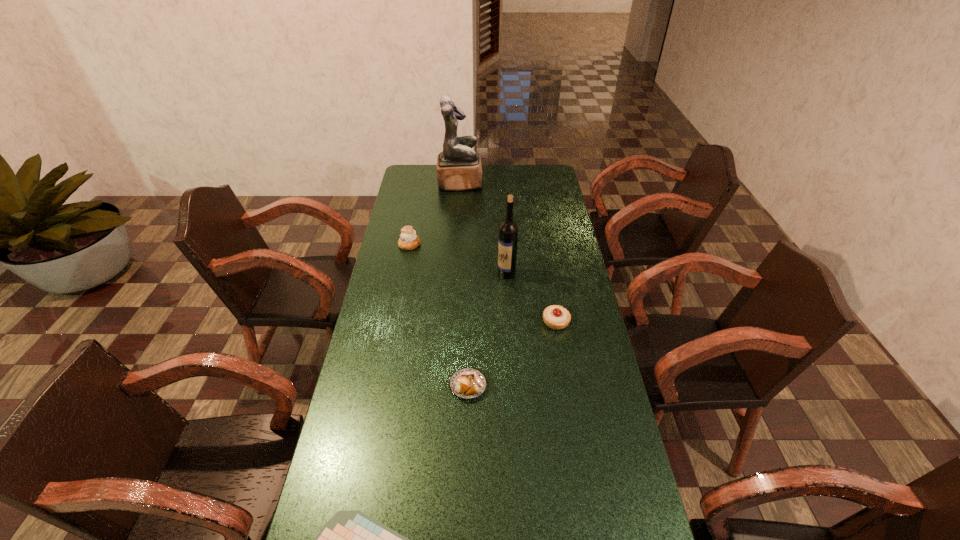
Image resolution: width=960 pixels, height=540 pixels. I want to click on vacant position located in a relaxed pose on the farthest object, so click(x=549, y=183).

Image resolution: width=960 pixels, height=540 pixels. What are the coordinates of `free space located on the label of the third farthest object` in the screenshot? It's located at (407, 274).

Where is `vacant space located on the label of the third farthest object`? This screenshot has height=540, width=960. vacant space located on the label of the third farthest object is located at coordinates (452, 274).

Identify the location of vacant space located on the label of the third farthest object. The width and height of the screenshot is (960, 540). pos(447,274).

In order to click on vacant space situated 0.090m on the back of the fifth nearest object in this screenshot , I will do `click(413, 226)`.

Find the location of a particular element. vacant space situated on the front of the rightmost object is located at coordinates (566, 381).

The image size is (960, 540). What are the coordinates of `vacant area situated 0.070m on the right of the second pastry from right to left` in the screenshot? It's located at (510, 386).

Find the location of a particular element. object that is at the far edge is located at coordinates (459, 167).

Where is `object situated at the left edge`? object situated at the left edge is located at coordinates tap(409, 240).

At what (x,y) coordinates should I click in order to perform the action: click on object at the right edge. Please return your answer as a coordinate pair (x, y). Looking at the image, I should click on (x=556, y=317).